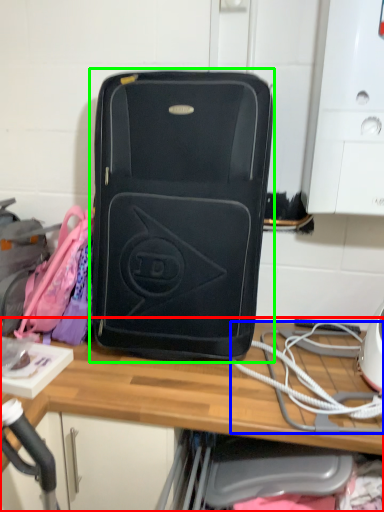
Question: Estimate the real-world distances between objects in this image. Which object is farther from desk (highlighted by a red box), rope (highlighted by a blue box) or luggage and bags (highlighted by a green box)?

Choices:
 (A) rope
 (B) luggage and bags

Answer: (B)